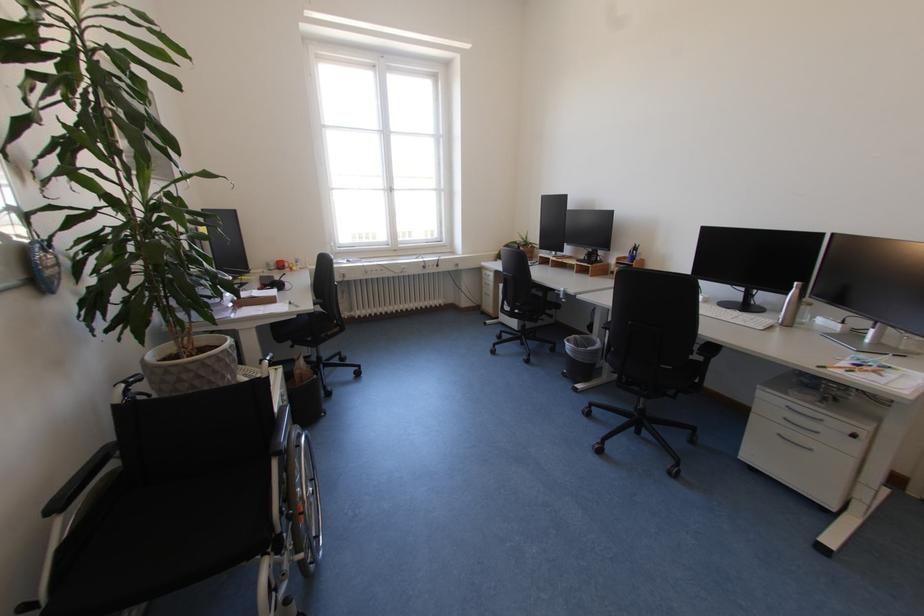
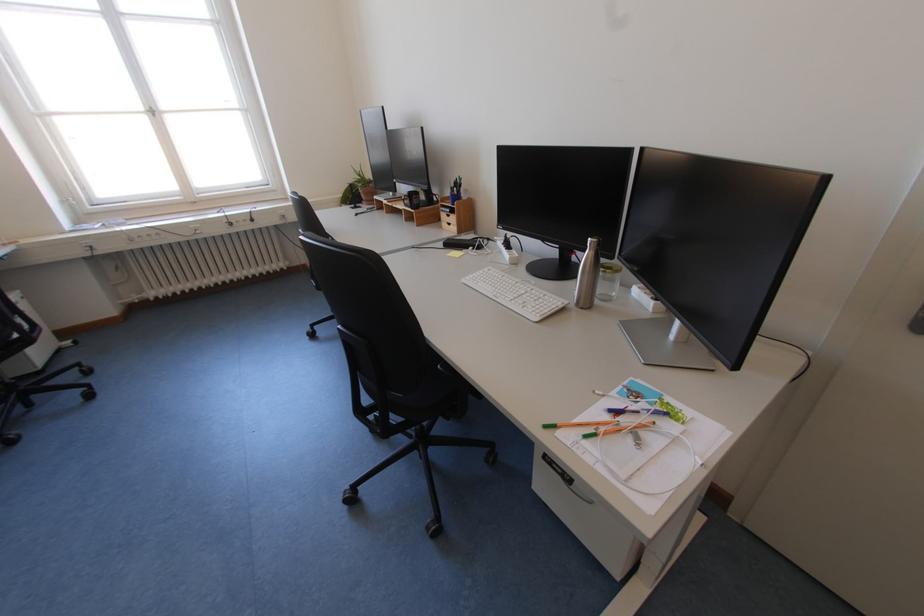
Locate, in the second image, the point that corresponds to [827,368] in the first image.

(553, 428)